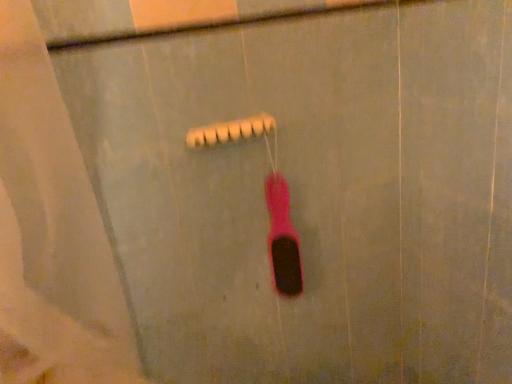
This screenshot has height=384, width=512. Describe the element at coordinates (230, 131) in the screenshot. I see `beige matte shower head at center` at that location.

What is the approximate height of beige matte shower head at center?

beige matte shower head at center is 1.25 inches in height.

Locate an element on the screen. The width and height of the screenshot is (512, 384). beige matte shower head at center is located at coordinates (230, 131).

The width and height of the screenshot is (512, 384). What do you see at coordinates (283, 238) in the screenshot?
I see `pink rubber toothbrush at center` at bounding box center [283, 238].

Find the location of a particular element. pink rubber toothbrush at center is located at coordinates tap(283, 238).

You are a GUI agent. You are given a task and a screenshot of the screen. Output one action in this format:
    pyautogui.click(x=<x>, y=<y>)
    Task: Click on the beige matte shower head at center
    
    Given the screenshot: What is the action you would take?
    pyautogui.click(x=230, y=131)

Considering the positions of objects beige matte shower head at center and pink rubber toothbrush at center in the image provided, who is more to the right, beige matte shower head at center or pink rubber toothbrush at center?

Positioned to the right is pink rubber toothbrush at center.

Which object is closer to the camera taking this photo, beige matte shower head at center or pink rubber toothbrush at center?

beige matte shower head at center is in front.

Which is behind, point (251, 128) or point (289, 194)?

Positioned behind is point (289, 194).

From the image's perspective, is beige matte shower head at center above pink rubber toothbrush at center?

Answer: Indeed, from the image's perspective, beige matte shower head at center is shown above pink rubber toothbrush at center.

From a real-world perspective, between beige matte shower head at center and pink rubber toothbrush at center, who is vertically higher?

beige matte shower head at center is physically above.

Is beige matte shower head at center thinner than pink rubber toothbrush at center?

No, beige matte shower head at center is not thinner than pink rubber toothbrush at center.

Is beige matte shower head at center shorter than pink rubber toothbrush at center?

Yes.

Is beige matte shower head at center bigger than pink rubber toothbrush at center?

No, beige matte shower head at center is not bigger than pink rubber toothbrush at center.

Would you say beige matte shower head at center is inside or outside pink rubber toothbrush at center?

beige matte shower head at center is not enclosed by pink rubber toothbrush at center.

Is beige matte shower head at center positioned far away from pink rubber toothbrush at center?

beige matte shower head at center is actually quite close to pink rubber toothbrush at center.

Does beige matte shower head at center turn towards pink rubber toothbrush at center?

No.

The image size is (512, 384). In order to click on shower above the pink rubber toothbrush at center (from a real-world perspective) in this screenshot , I will do click(230, 131).

Does pink rubber toothbrush at center appear on the right side of beige matte shower head at center?

Indeed, pink rubber toothbrush at center is positioned on the right side of beige matte shower head at center.

Is pink rubber toothbrush at center further to the viewer compared to beige matte shower head at center?

Yes, it is.

Is point (278, 197) in front of point (239, 123)?

No, (278, 197) is behind (239, 123).

From the image's perspective, is pink rubber toothbrush at center below beige matte shower head at center?

Indeed, from the image's perspective, pink rubber toothbrush at center is shown beneath beige matte shower head at center.

From a real-world perspective, does pink rubber toothbrush at center sit lower than beige matte shower head at center?

Yes.

Considering the sizes of objects pink rubber toothbrush at center and beige matte shower head at center in the image provided, who is thinner, pink rubber toothbrush at center or beige matte shower head at center?

Thinner between the two is pink rubber toothbrush at center.

In terms of height, does pink rubber toothbrush at center look taller or shorter compared to beige matte shower head at center?

Clearly, pink rubber toothbrush at center is taller compared to beige matte shower head at center.

Who is bigger, pink rubber toothbrush at center or beige matte shower head at center?

Bigger between the two is pink rubber toothbrush at center.

Choose the correct answer: Is pink rubber toothbrush at center inside beige matte shower head at center or outside it?

pink rubber toothbrush at center lies outside beige matte shower head at center.

Is pink rubber toothbrush at center not near beige matte shower head at center?

pink rubber toothbrush at center is near beige matte shower head at center, not far away.

Could you tell me if pink rubber toothbrush at center is turned towards beige matte shower head at center?

No, pink rubber toothbrush at center is not facing towards beige matte shower head at center.

Can you tell me how much pink rubber toothbrush at center and beige matte shower head at center differ in facing direction?

25.1 degrees separate the facing orientations of pink rubber toothbrush at center and beige matte shower head at center.

Identify the location of shower to the left of pink rubber toothbrush at center. Image resolution: width=512 pixels, height=384 pixels. (230, 131).

The image size is (512, 384). Identify the location of toothbrush behind the beige matte shower head at center. (283, 238).

Identify the location of shower on the left of pink rubber toothbrush at center. (230, 131).